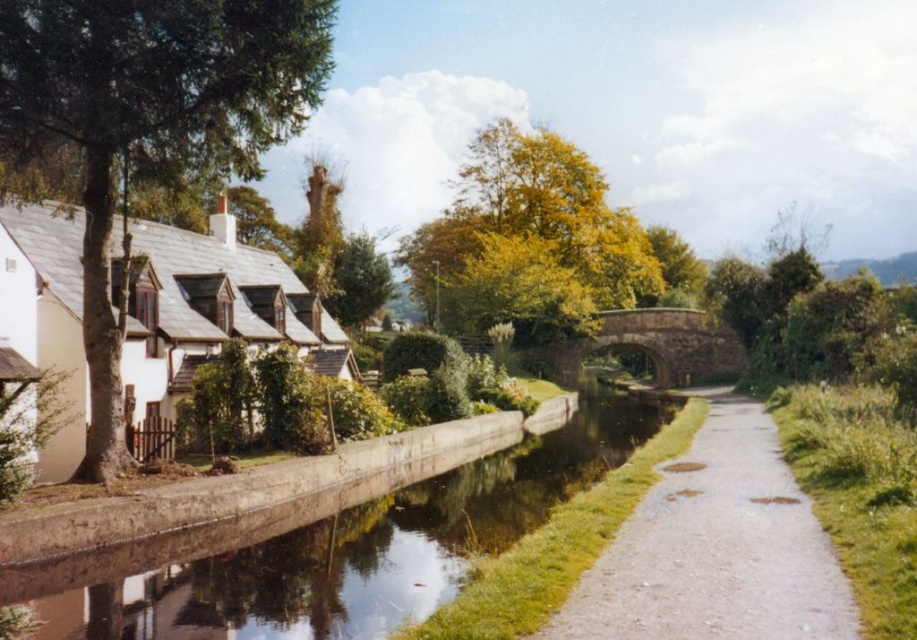
You are standing at the edge of the canal and want to walk towards the white matte cottage at left. Which direction should you head to reach it first, considering the gravelly gray path at center is in your way?

Since the gravelly gray path at center is closer to the viewer than the white matte cottage at left, you should head towards the gravelly gray path at center first before proceeding to the cottage.

You are a tourist visiting this village and want to walk along the canal. You see the gravelly gray path at center and the white matte cottage at left. Which of these two is narrower in width?

The gravelly gray path at center is smaller than the white matte cottage at left, so the gravelly gray path at center is narrower in width.

You are standing on the grassy path next to the smooth concrete canal at center and want to reach the white matte cottage at left. Which direction should you walk to get there?

Since the smooth concrete canal at center is positioned on the right side of the white matte cottage at left, you should walk to the left to reach the white matte cottage at left from the canal.